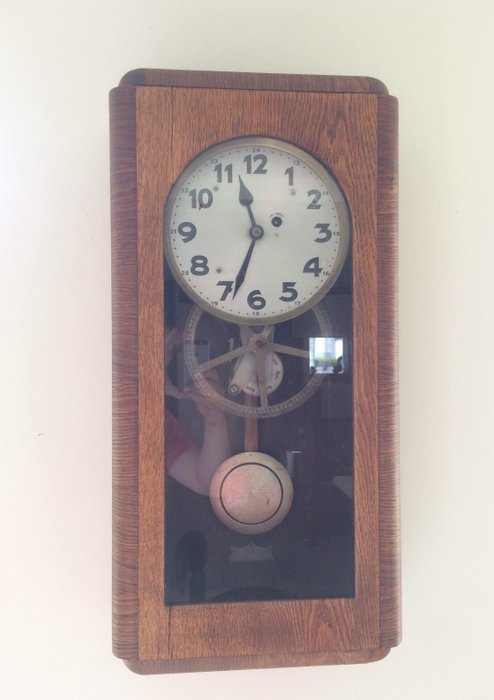
This screenshot has height=700, width=494. Identify the location of black circle on clock face. (279, 222).